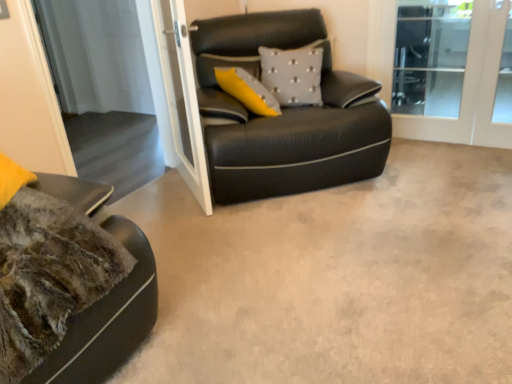
Where is `black leather studio couch at center`? Image resolution: width=512 pixels, height=384 pixels. black leather studio couch at center is located at coordinates (285, 114).

Image resolution: width=512 pixels, height=384 pixels. What do you see at coordinates (285, 114) in the screenshot?
I see `black leather studio couch at center` at bounding box center [285, 114].

Where is `transparent glass screen door at upper center, acting as the 1th screen door starting from the left`? The image size is (512, 384). transparent glass screen door at upper center, acting as the 1th screen door starting from the left is located at coordinates (175, 91).

From a real-world perspective, starting from the gray textured pillow at center, which screen door is the 3rd one below it? Please provide its 2D coordinates.

[(470, 89)]

Looking at this image, from the image's perspective, is clear glass screen door at upper right, marked as the first screen door in a right-to-left arrangement, beneath gray textured pillow at center?

Result: No, from the image's perspective, clear glass screen door at upper right, marked as the first screen door in a right-to-left arrangement, is not below gray textured pillow at center.

From a real-world perspective, is clear glass screen door at upper right, arranged as the 3th screen door when viewed from the left, above or below gray textured pillow at center?

In terms of real-world spatial position, clear glass screen door at upper right, arranged as the 3th screen door when viewed from the left, is below gray textured pillow at center.

Which is behind, clear glass screen door at upper right, marked as the first screen door in a right-to-left arrangement, or gray textured pillow at center?

clear glass screen door at upper right, marked as the first screen door in a right-to-left arrangement, is more distant.

From a real-world perspective, is black leather studio couch at center beneath white glass screen door at upper center, the second screen door viewed from the right?

Yes, from a real-world perspective, black leather studio couch at center is beneath white glass screen door at upper center, the second screen door viewed from the right.

Are black leather studio couch at center and white glass screen door at upper center, which is the second screen door from left to right, far apart?

That's not correct — black leather studio couch at center is a little close to white glass screen door at upper center, which is the second screen door from left to right.

This screenshot has height=384, width=512. In order to click on studio couch below the white glass screen door at upper center, the second screen door viewed from the right (from a real-world perspective) in this screenshot , I will do 285,114.

In terms of height, does black leather studio couch at center look taller or shorter compared to white glass screen door at upper center, the second screen door viewed from the right?

black leather studio couch at center is shorter than white glass screen door at upper center, the second screen door viewed from the right.

Considering the relative positions of white glass screen door at upper center, the second screen door viewed from the right, and transparent glass screen door at upper center, which is the 3th screen door in right-to-left order, in the image provided, is white glass screen door at upper center, the second screen door viewed from the right, to the right of transparent glass screen door at upper center, which is the 3th screen door in right-to-left order, from the viewer's perspective?

Yes.

Does white glass screen door at upper center, the second screen door viewed from the right, have a greater height compared to transparent glass screen door at upper center, acting as the 1th screen door starting from the left?

No.

What's the angular difference between white glass screen door at upper center, which is the second screen door from left to right, and transparent glass screen door at upper center, acting as the 1th screen door starting from the left,'s facing directions?

50.7 degrees separate the facing orientations of white glass screen door at upper center, which is the second screen door from left to right, and transparent glass screen door at upper center, acting as the 1th screen door starting from the left.

From the picture: Does white glass screen door at upper center, which is the second screen door from left to right, have a lesser width compared to transparent glass screen door at upper center, which is the 3th screen door in right-to-left order?

Yes, white glass screen door at upper center, which is the second screen door from left to right, is thinner than transparent glass screen door at upper center, which is the 3th screen door in right-to-left order.

This screenshot has height=384, width=512. Identify the location of screen door on the right of the white glass screen door at upper center, which is the second screen door from left to right. (470, 89).

Can you confirm if white glass screen door at upper center, the second screen door viewed from the right, is positioned to the left of clear glass screen door at upper right, arranged as the 3th screen door when viewed from the left?

Yes, white glass screen door at upper center, the second screen door viewed from the right, is to the left of clear glass screen door at upper right, arranged as the 3th screen door when viewed from the left.

Considering the relative sizes of white glass screen door at upper center, which is the second screen door from left to right, and clear glass screen door at upper right, arranged as the 3th screen door when viewed from the left, in the image provided, is white glass screen door at upper center, which is the second screen door from left to right, wider than clear glass screen door at upper right, arranged as the 3th screen door when viewed from the left,?

Correct, the width of white glass screen door at upper center, which is the second screen door from left to right, exceeds that of clear glass screen door at upper right, arranged as the 3th screen door when viewed from the left.

Is white glass screen door at upper center, the second screen door viewed from the right, situated inside clear glass screen door at upper right, arranged as the 3th screen door when viewed from the left, or outside?

white glass screen door at upper center, the second screen door viewed from the right, is not enclosed by clear glass screen door at upper right, arranged as the 3th screen door when viewed from the left.

In the scene shown: Considering the positions of objects clear glass screen door at upper right, marked as the first screen door in a right-to-left arrangement, and black leather studio couch at center in the image provided, who is more to the left, clear glass screen door at upper right, marked as the first screen door in a right-to-left arrangement, or black leather studio couch at center?

From the viewer's perspective, black leather studio couch at center appears more on the left side.

Looking at this image, how different are the orientations of clear glass screen door at upper right, arranged as the 3th screen door when viewed from the left, and black leather studio couch at center in degrees?

43.9 degrees separate the facing orientations of clear glass screen door at upper right, arranged as the 3th screen door when viewed from the left, and black leather studio couch at center.

From the picture: Looking at their sizes, would you say clear glass screen door at upper right, marked as the first screen door in a right-to-left arrangement, is wider or thinner than black leather studio couch at center?

clear glass screen door at upper right, marked as the first screen door in a right-to-left arrangement, is thinner than black leather studio couch at center.

Measure the distance from clear glass screen door at upper right, arranged as the 3th screen door when viewed from the left, to black leather studio couch at center.

3.51 feet.

Between point (158, 106) and point (211, 127), which one is positioned in front?

The point (211, 127) is closer.

Where is `studio couch in front of the transparent glass screen door at upper center, which is the 3th screen door in right-to-left order`? studio couch in front of the transparent glass screen door at upper center, which is the 3th screen door in right-to-left order is located at coordinates (285, 114).

Is transparent glass screen door at upper center, acting as the 1th screen door starting from the left, shorter than black leather studio couch at center?

Answer: No, transparent glass screen door at upper center, acting as the 1th screen door starting from the left, is not shorter than black leather studio couch at center.

Which of these two, transparent glass screen door at upper center, acting as the 1th screen door starting from the left, or black leather studio couch at center, is bigger?

With larger size is black leather studio couch at center.

Does point (162, 27) come farther from viewer compared to point (282, 106)?

Yes, point (162, 27) is farther from viewer.

Is transparent glass screen door at upper center, which is the 3th screen door in right-to-left order, turned away from gray textured pillow at center?

No, gray textured pillow at center is not at the back of transparent glass screen door at upper center, which is the 3th screen door in right-to-left order.

This screenshot has height=384, width=512. Identify the location of pillow that is behind the transparent glass screen door at upper center, which is the 3th screen door in right-to-left order. (293, 74).

From a real-world perspective, between transparent glass screen door at upper center, acting as the 1th screen door starting from the left, and gray textured pillow at center, who is vertically higher?

From a 3D spatial view, gray textured pillow at center is above.

You are a GUI agent. You are given a task and a screenshot of the screen. Output one action in this format:
    pyautogui.click(x=<x>, y=<y>)
    Task: Click on the pillow in front of the clear glass screen door at upper right, marked as the first screen door in a right-to-left arrangement
    Image resolution: width=512 pixels, height=384 pixels.
    Given the screenshot: What is the action you would take?
    pyautogui.click(x=293, y=74)

Where is `studio couch that is behind the white glass screen door at upper center, the second screen door viewed from the right`? studio couch that is behind the white glass screen door at upper center, the second screen door viewed from the right is located at coordinates (285, 114).

From the image, which object appears to be farther from transparent glass screen door at upper center, which is the 3th screen door in right-to-left order, black leather studio couch at center or clear glass screen door at upper right, marked as the first screen door in a right-to-left arrangement?

clear glass screen door at upper right, marked as the first screen door in a right-to-left arrangement.

From the picture: From the image, which object appears to be farther from white glass screen door at upper center, which is the second screen door from left to right, black leather studio couch at center or clear glass screen door at upper right, arranged as the 3th screen door when viewed from the left?

clear glass screen door at upper right, arranged as the 3th screen door when viewed from the left, lies further to white glass screen door at upper center, which is the second screen door from left to right, than the other object.

In the scene shown: When comparing their distances from white glass screen door at upper center, the second screen door viewed from the right, does transparent glass screen door at upper center, acting as the 1th screen door starting from the left, or clear glass screen door at upper right, marked as the first screen door in a right-to-left arrangement, seem further?

clear glass screen door at upper right, marked as the first screen door in a right-to-left arrangement, is positioned further to the anchor white glass screen door at upper center, the second screen door viewed from the right.

Based on their spatial positions, is white glass screen door at upper center, the second screen door viewed from the right, or clear glass screen door at upper right, marked as the first screen door in a right-to-left arrangement, closer to gray textured pillow at center?

Based on the image, white glass screen door at upper center, the second screen door viewed from the right, appears to be nearer to gray textured pillow at center.

Looking at the image, which one is located further to clear glass screen door at upper right, marked as the first screen door in a right-to-left arrangement, gray textured pillow at center or black leather studio couch at center?

Among the two, black leather studio couch at center is located further to clear glass screen door at upper right, marked as the first screen door in a right-to-left arrangement.

Estimate the real-world distances between objects in this image. Which object is further from transparent glass screen door at upper center, acting as the 1th screen door starting from the left, black leather studio couch at center or gray textured pillow at center?

Based on the image, gray textured pillow at center appears to be further to transparent glass screen door at upper center, acting as the 1th screen door starting from the left.

Considering their positions, is transparent glass screen door at upper center, acting as the 1th screen door starting from the left, positioned closer to gray textured pillow at center than black leather studio couch at center?

black leather studio couch at center is positioned closer to the anchor gray textured pillow at center.

Considering their positions, is gray textured pillow at center positioned further to white glass screen door at upper center, which is the second screen door from left to right, than transparent glass screen door at upper center, which is the 3th screen door in right-to-left order?

gray textured pillow at center lies further to white glass screen door at upper center, which is the second screen door from left to right, than the other object.

You are a GUI agent. You are given a task and a screenshot of the screen. Output one action in this format:
    pyautogui.click(x=<x>, y=<y>)
    Task: Click on the screen door between transparent glass screen door at upper center, acting as the 1th screen door starting from the left, and clear glass screen door at upper right, arranged as the 3th screen door when viewed from the left, in the horizontal direction
    
    Given the screenshot: What is the action you would take?
    coord(182,96)

Locate an element on the screen. The width and height of the screenshot is (512, 384). studio couch situated between white glass screen door at upper center, the second screen door viewed from the right, and gray textured pillow at center from left to right is located at coordinates (285, 114).

Where is `pillow between black leather studio couch at center and clear glass screen door at upper right, arranged as the 3th screen door when viewed from the left, from left to right`? pillow between black leather studio couch at center and clear glass screen door at upper right, arranged as the 3th screen door when viewed from the left, from left to right is located at coordinates (293, 74).

The height and width of the screenshot is (384, 512). I want to click on studio couch between transparent glass screen door at upper center, which is the 3th screen door in right-to-left order, and clear glass screen door at upper right, marked as the first screen door in a right-to-left arrangement, so click(x=285, y=114).